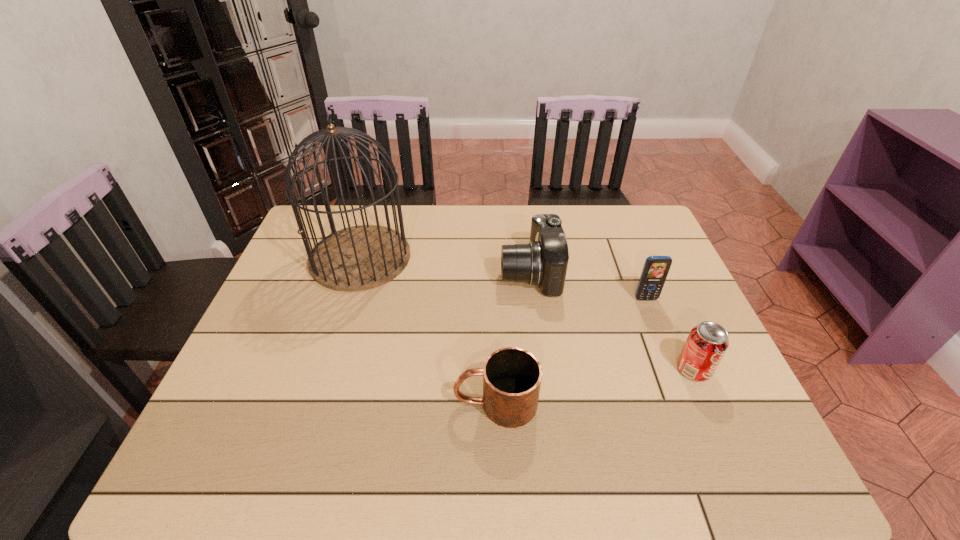
Locate an element on the screen. This screenshot has width=960, height=540. object at the far left corner is located at coordinates (358, 258).

The image size is (960, 540). I want to click on blank area at the far edge, so click(x=420, y=219).

What are the coordinates of `free space at the near edge of the desktop` in the screenshot? It's located at (353, 456).

Where is `free space at the left edge`? The width and height of the screenshot is (960, 540). free space at the left edge is located at coordinates coord(204,432).

The image size is (960, 540). What are the coordinates of `vacant region at the near left corner` in the screenshot? It's located at (258, 477).

I want to click on unoccupied area between the tallest object and the mug, so click(x=428, y=330).

This screenshot has width=960, height=540. Identify the location of blank region between the soda can and the camera. (612, 321).

The height and width of the screenshot is (540, 960). I want to click on free space between the cellular telephone and the camera, so click(x=588, y=286).

You are a GUI agent. You are given a task and a screenshot of the screen. Output one action in this format:
    pyautogui.click(x=<x>, y=<y>)
    Task: Click on the free space between the cellular telephone and the camera
    This screenshot has width=960, height=540.
    Given the screenshot: What is the action you would take?
    pyautogui.click(x=588, y=286)

Locate an element on the screen. Image resolution: width=960 pixels, height=540 pixels. free space that is in between the camera and the tallest object is located at coordinates [445, 265].